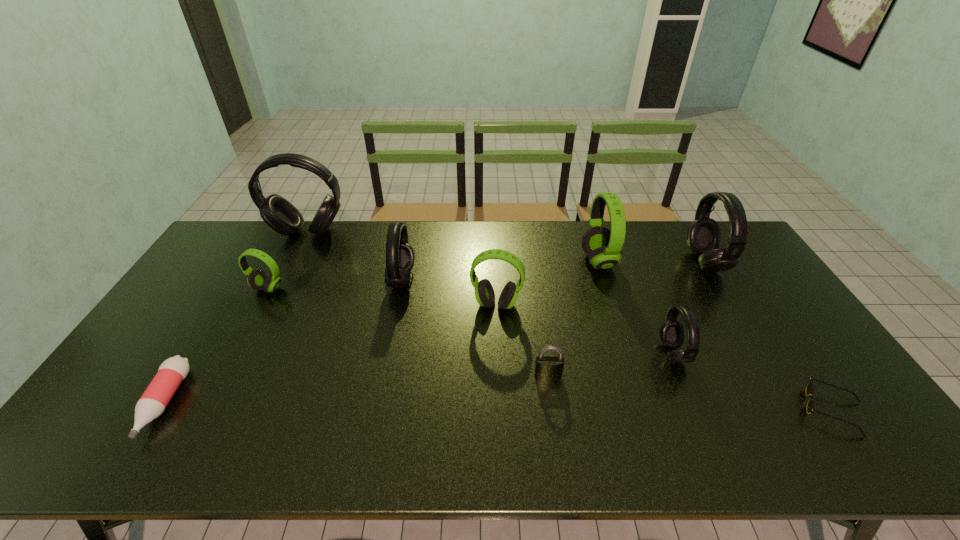
Where is `the tallest headset`? Image resolution: width=960 pixels, height=540 pixels. the tallest headset is located at coordinates (278, 213).

Identify the location of the tallest object. click(x=278, y=213).

What are the coordinates of `the biggest green headset` in the screenshot? It's located at (603, 246).

Locate an element on the screen. The image size is (960, 540). the fourth object from right to left is located at coordinates 603,246.

Locate an element on the screen. Image resolution: width=960 pixels, height=540 pixels. the rightmost gray headset is located at coordinates (703, 234).

The height and width of the screenshot is (540, 960). In order to click on the third smallest gray headset in this screenshot , I will do click(703, 234).

Locate an element on the screen. The height and width of the screenshot is (540, 960). the fourth object from left to right is located at coordinates (400, 255).

The image size is (960, 540). I want to click on the third gray headset from right to left, so click(400, 255).

Locate an element on the screen. the second smallest green headset is located at coordinates (484, 292).

Identify the location of the fourth headset from left to right. This screenshot has width=960, height=540. pyautogui.click(x=484, y=292).